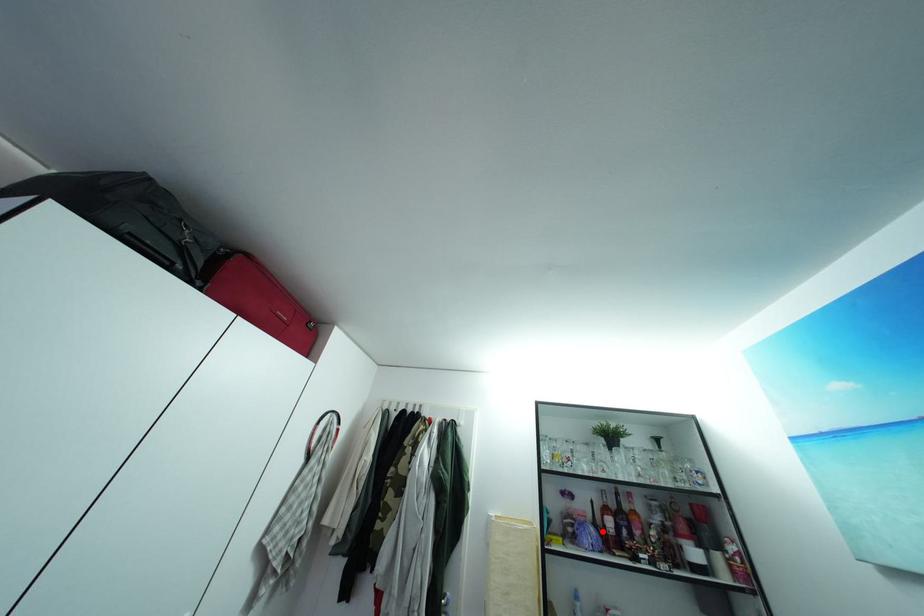
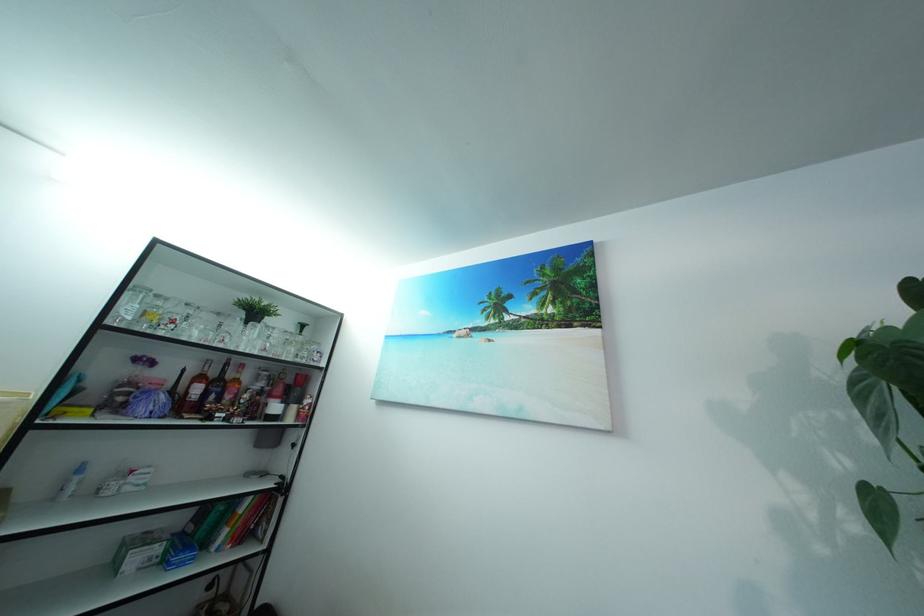
In the second image, find the point that corresponds to the highlighted location in the first image.

(179, 399)